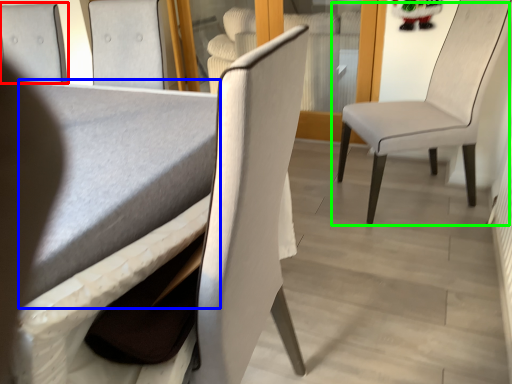
Question: Which object is the closest to the chair (highlighted by a red box)? Choose among these: table (highlighted by a blue box) or chair (highlighted by a green box).

Choices:
 (A) table
 (B) chair

Answer: (A)